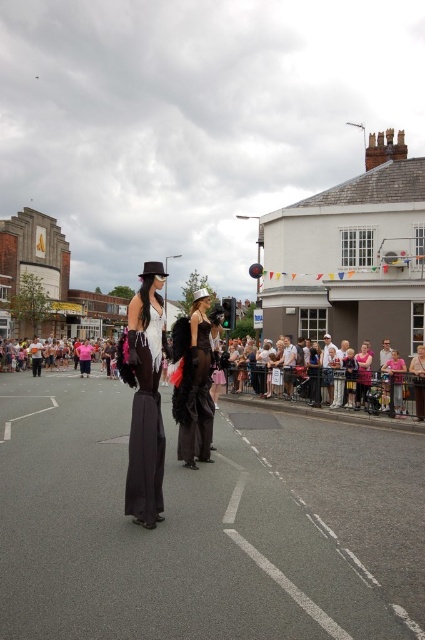
You are a photographer trying to capture the parade scene. You want to ensure both the pink fabric crowd at center and the matte black dress at center are visible in your shot. Which object should you focus on to ensure both are in frame?

The pink fabric crowd at center is larger in size than the matte black dress at center, so focusing on the pink fabric crowd at center would help ensure both are visible in the frame since it occupies more space.

Based on the scene description, where exactly is the pink fabric crowd at center located in the image?

The pink fabric crowd at center is located at point (331, 385).